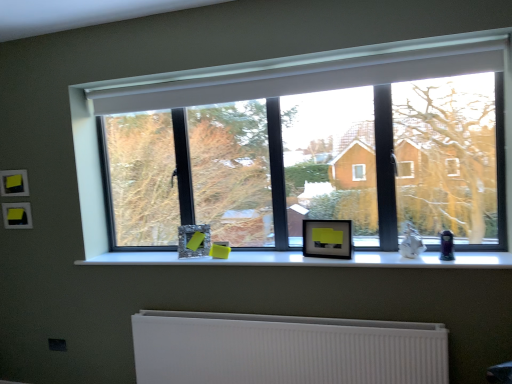
Where is `free space above matte glass picture frame at center, which ranks as the second picture frame in right-to-left order (from a real-world perspective)`? free space above matte glass picture frame at center, which ranks as the second picture frame in right-to-left order (from a real-world perspective) is located at coordinates (199, 221).